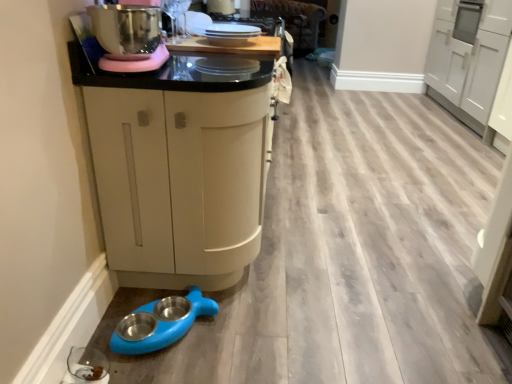
You are a GUI agent. You are given a task and a screenshot of the screen. Output one action in this format:
    pyautogui.click(x=<x>, y=<y>)
    Task: Click on the free location to the right of blue rubber pet bowls at lower left
    
    Given the screenshot: What is the action you would take?
    pyautogui.click(x=236, y=329)